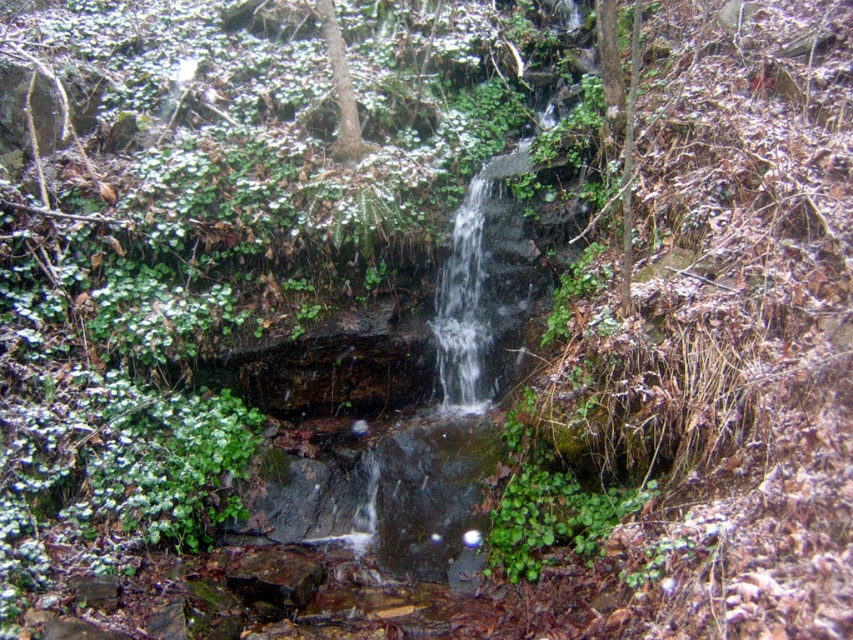
Can you confirm if brown rough tree at center is shorter than green leafy tree at center?

In fact, brown rough tree at center may be taller than green leafy tree at center.

I want to click on brown rough tree at center, so click(341, 90).